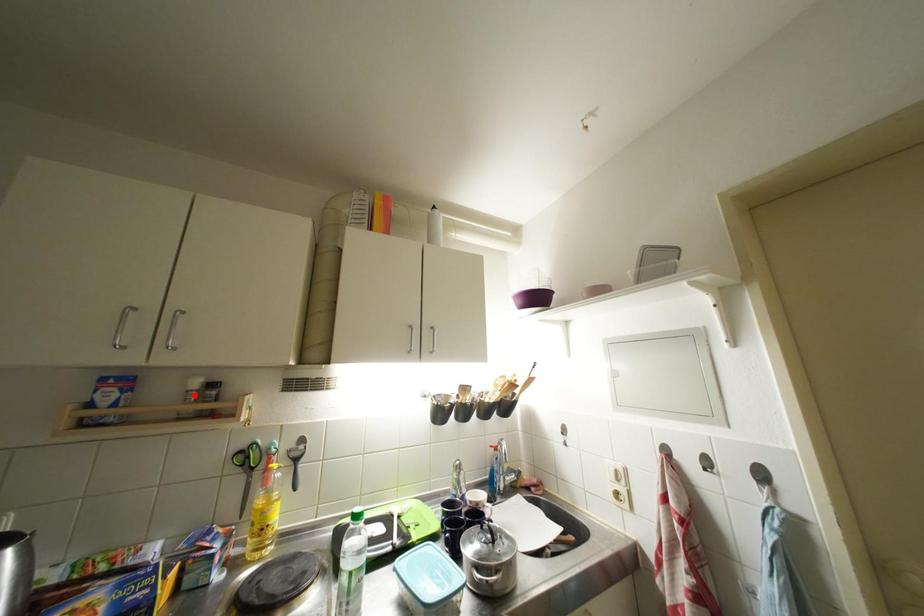
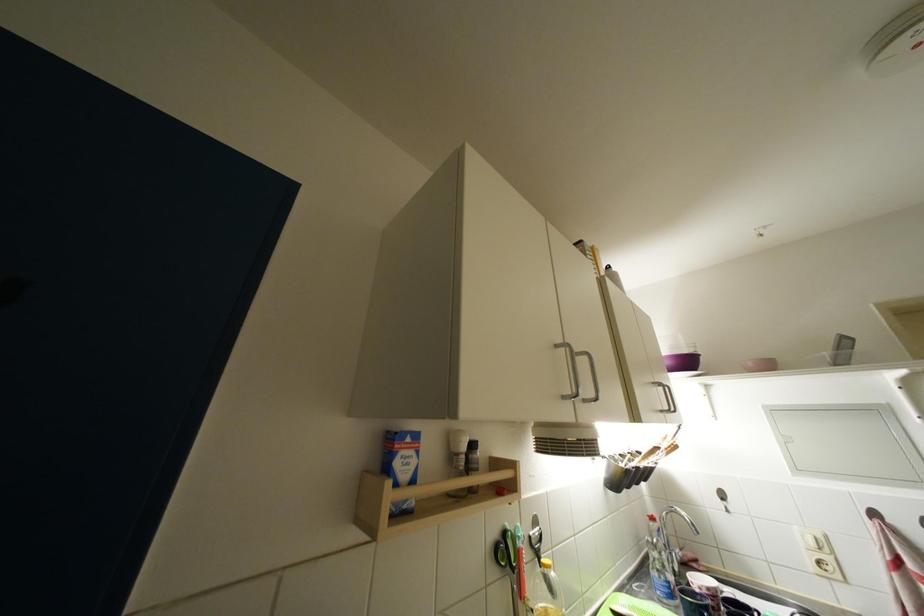
The point at the highlighted location is marked in the first image. Where is the corresponding point in the second image?

(464, 458)